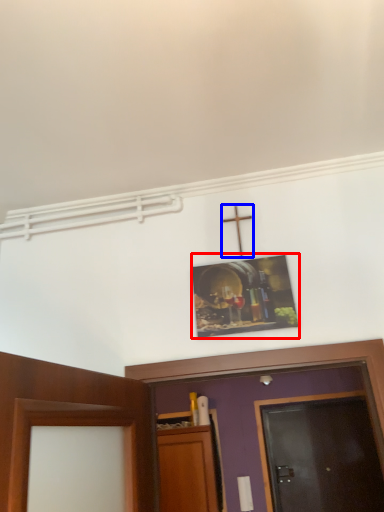
Question: Which of the following is the farthest to the observer, picture frame (highlighted by a red box) or crucifix (highlighted by a blue box)?

Choices:
 (A) picture frame
 (B) crucifix

Answer: (B)